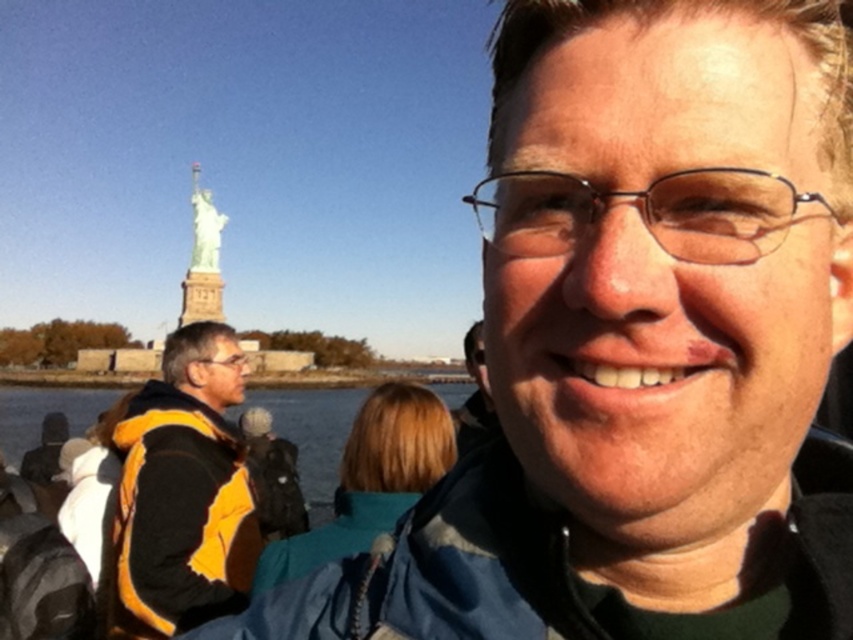
You are a photographer planning to take a photo of the Statue of Liberty from the same spot as the person in the image. You want to ensure that both the teal fabric jacket at center and the clear water at lower left are in focus. Given that your camera can only focus on objects within a 100 feet range, will both objects be in focus?

The teal fabric jacket at center and clear water at lower left are 96.66 feet apart. Since the distance between them is within the camera focus range of 100 feet, both objects will be in focus.